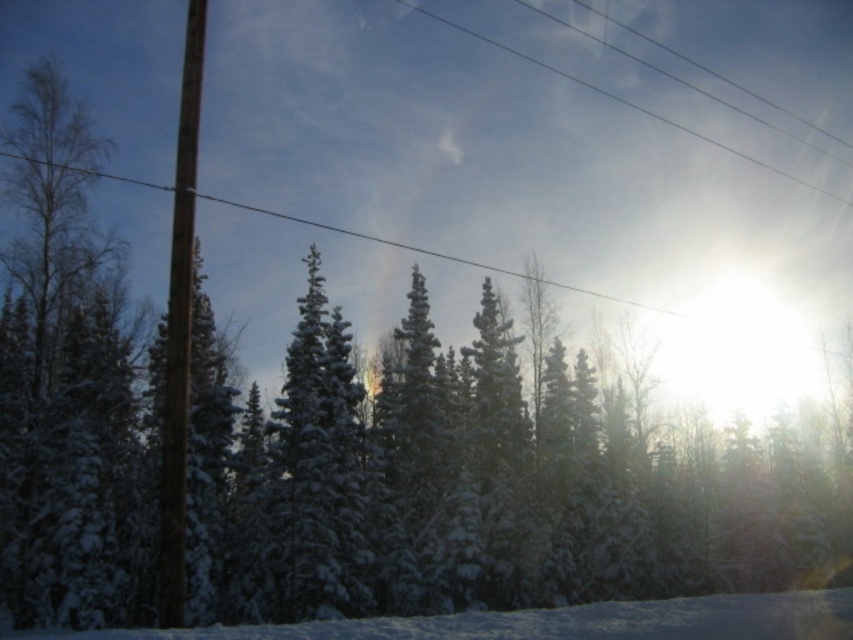
You are standing at the center of the winter landscape scene. You want to place a small red flag exactly at the point where the white snow at lower center is located. What are the coordinates of this point?

The coordinates of the white snow at lower center are at point (561, 621).

You are an observer standing in the winter landscape. You notice the white snow at lower center and the clear plastic power lines at upper center. Which object is positioned more to the left in the scene?

The white snow at lower center is positioned more to the left than the clear plastic power lines at upper center.